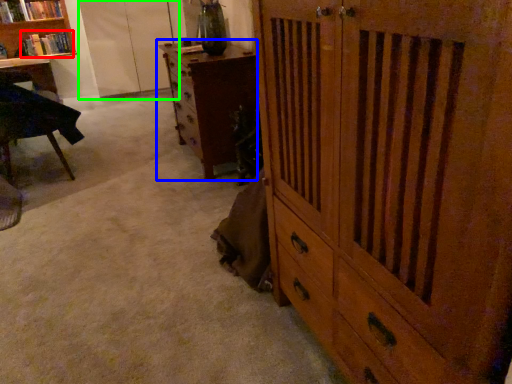
Question: Estimate the real-world distances between objects in this image. Which object is closer to book (highlighted by a red box), chest of drawers (highlighted by a blue box) or screen door (highlighted by a green box)?

Choices:
 (A) chest of drawers
 (B) screen door

Answer: (B)